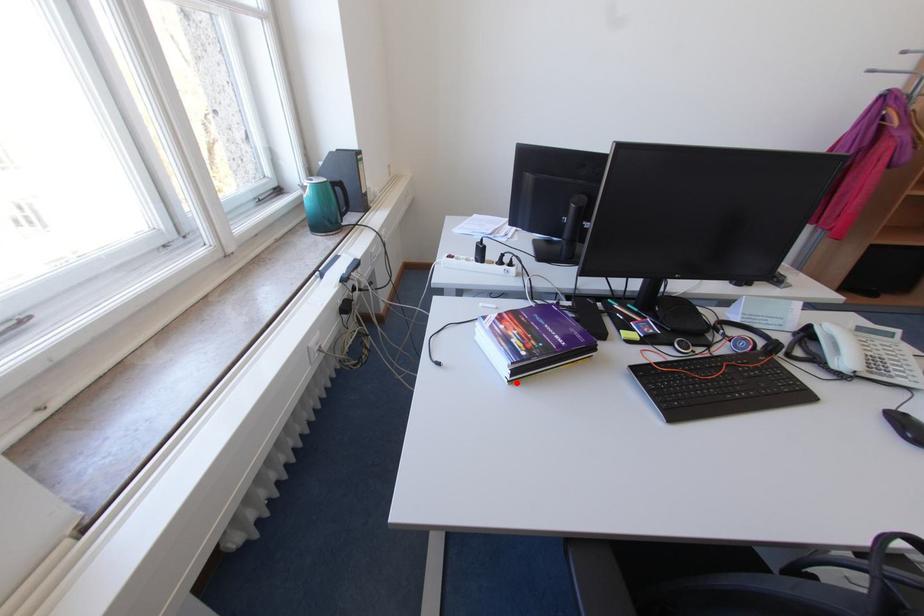
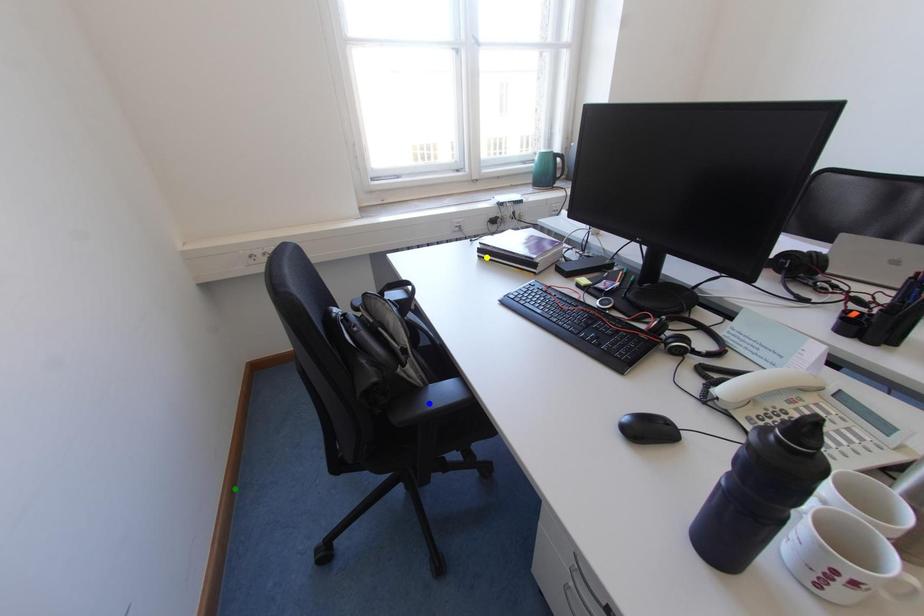
Question: I am providing you with two images of the same scene from different viewpoints. A red point is marked on the first image. You are given multiple points on the second image. Which spot in image 2 lines up with the point in image 1?

Choices:
 (A) blue point
 (B) yellow point
 (C) green point

Answer: (B)